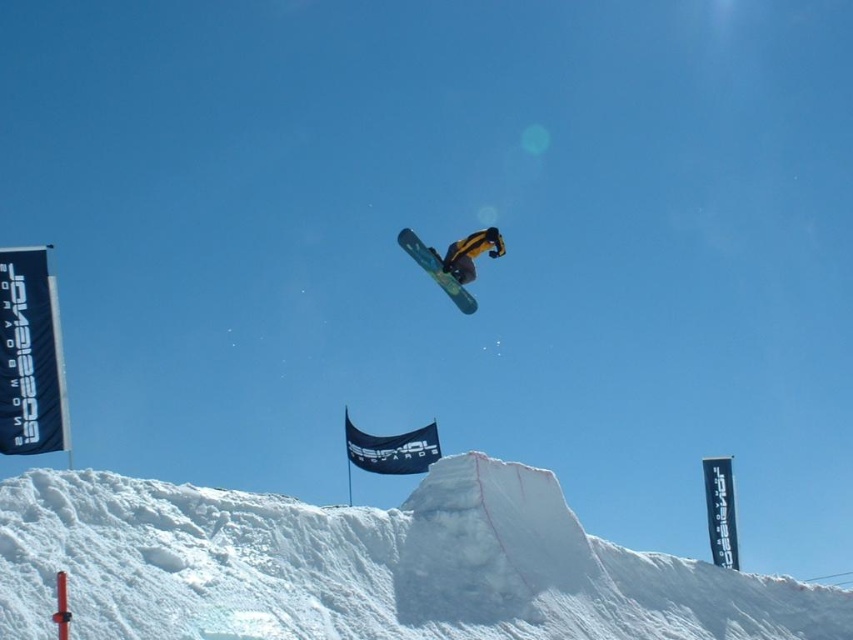
Question: Does white fluffy snow at center have a lesser width compared to blue matte snowboard at center?

Choices:
 (A) no
 (B) yes

Answer: (A)

Question: Which point is closer to the camera taking this photo?

Choices:
 (A) (426, 248)
 (B) (450, 273)
 (C) (276, 536)

Answer: (C)

Question: Which point is closer to the camera?

Choices:
 (A) blue matte snowboard at center
 (B) white fluffy snow at center

Answer: (B)

Question: In this image, where is white fluffy snow at center located relative to blue matte snowboard at center?

Choices:
 (A) left
 (B) right

Answer: (B)

Question: Which is farther from the blue matte snowboard at center?

Choices:
 (A) yellow matte snowboarder at center
 (B) white fluffy snow at center

Answer: (B)

Question: Considering the relative positions of blue matte snowboard at center and yellow matte snowboarder at center in the image provided, where is blue matte snowboard at center located with respect to yellow matte snowboarder at center?

Choices:
 (A) right
 (B) left

Answer: (B)